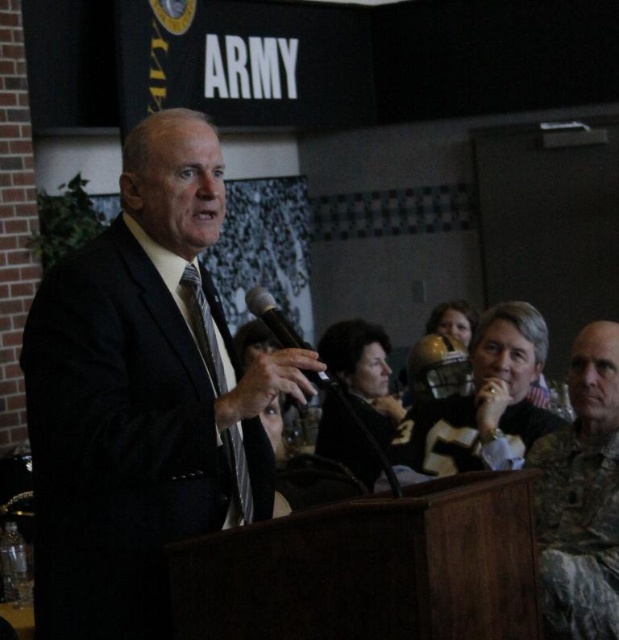
Question: Is camouflage uniform at right wider than matte black tie at center?

Choices:
 (A) no
 (B) yes

Answer: (B)

Question: Which of the following is the farthest from the observer?

Choices:
 (A) camouflage uniform at center
 (B) black matte microphone at center

Answer: (A)

Question: Which object is the closest to the dark suit at center?

Choices:
 (A) camouflage uniform at center
 (B) camouflage uniform at right

Answer: (B)

Question: Which is farther from the matte black tie at center?

Choices:
 (A) black matte microphone at center
 (B) camouflage uniform at right
 (C) camouflage uniform at center
 (D) dark suit at center

Answer: (C)

Question: Does camouflage uniform at right appear under matte black tie at center?

Choices:
 (A) yes
 (B) no

Answer: (A)

Question: Does dark suit at center have a greater width compared to camouflage uniform at right?

Choices:
 (A) yes
 (B) no

Answer: (A)